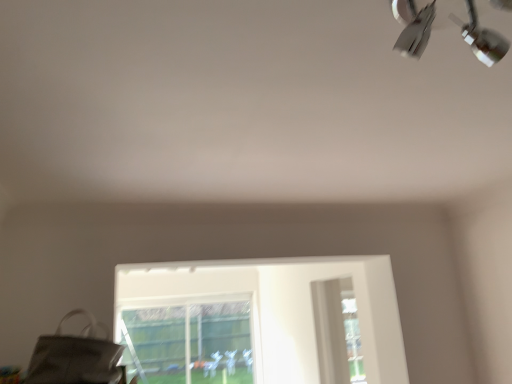
Question: From a real-world perspective, is metallic silver lamp at upper right on top of matte gray messenger bag at lower left?

Choices:
 (A) yes
 (B) no

Answer: (A)

Question: From the image's perspective, is metallic silver lamp at upper right below matte gray messenger bag at lower left?

Choices:
 (A) no
 (B) yes

Answer: (A)

Question: From the image's perspective, does metallic silver lamp at upper right appear higher than matte gray messenger bag at lower left?

Choices:
 (A) yes
 (B) no

Answer: (A)

Question: Does metallic silver lamp at upper right appear on the left side of matte gray messenger bag at lower left?

Choices:
 (A) no
 (B) yes

Answer: (A)

Question: Is metallic silver lamp at upper right wider than matte gray messenger bag at lower left?

Choices:
 (A) yes
 (B) no

Answer: (B)

Question: Is metallic silver lamp at upper right oriented towards matte gray messenger bag at lower left?

Choices:
 (A) yes
 (B) no

Answer: (B)

Question: Can we say matte gray messenger bag at lower left lies outside metallic silver lamp at upper right?

Choices:
 (A) no
 (B) yes

Answer: (B)

Question: From the image's perspective, is matte gray messenger bag at lower left on top of metallic silver lamp at upper right?

Choices:
 (A) yes
 (B) no

Answer: (B)

Question: Does matte gray messenger bag at lower left lie behind metallic silver lamp at upper right?

Choices:
 (A) yes
 (B) no

Answer: (A)

Question: Considering the relative positions of matte gray messenger bag at lower left and metallic silver lamp at upper right in the image provided, is matte gray messenger bag at lower left to the left of metallic silver lamp at upper right from the viewer's perspective?

Choices:
 (A) no
 (B) yes

Answer: (B)

Question: Can you confirm if matte gray messenger bag at lower left is smaller than metallic silver lamp at upper right?

Choices:
 (A) no
 (B) yes

Answer: (A)

Question: Is matte gray messenger bag at lower left positioned with its back to metallic silver lamp at upper right?

Choices:
 (A) no
 (B) yes

Answer: (A)

Question: Is matte gray messenger bag at lower left to the right of transparent glass bay window at lower center from the viewer's perspective?

Choices:
 (A) no
 (B) yes

Answer: (B)